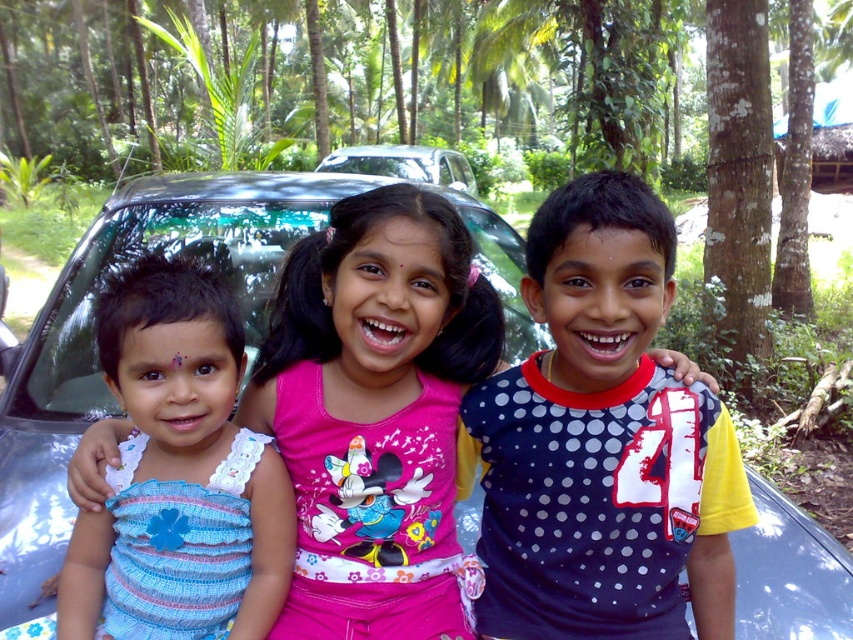
Question: Is metallic blue car at center below satin black car at center?

Choices:
 (A) yes
 (B) no

Answer: (A)

Question: Is polka dot jersey at center positioned in front of pink fabric shirt at center?

Choices:
 (A) no
 (B) yes

Answer: (B)

Question: Estimate the real-world distances between objects in this image. Which object is closer to the blue striped dress at left?

Choices:
 (A) polka dot jersey at center
 (B) satin black car at center
 (C) metallic blue car at center
 (D) pink fabric shirt at center

Answer: (D)

Question: Which object is closer to the camera taking this photo?

Choices:
 (A) metallic blue car at center
 (B) blue striped dress at left

Answer: (B)

Question: Can you confirm if metallic blue car at center is bigger than satin black car at center?

Choices:
 (A) no
 (B) yes

Answer: (A)

Question: Considering the real-world distances, which object is farthest from the satin black car at center?

Choices:
 (A) metallic blue car at center
 (B) polka dot jersey at center
 (C) pink fabric shirt at center

Answer: (B)